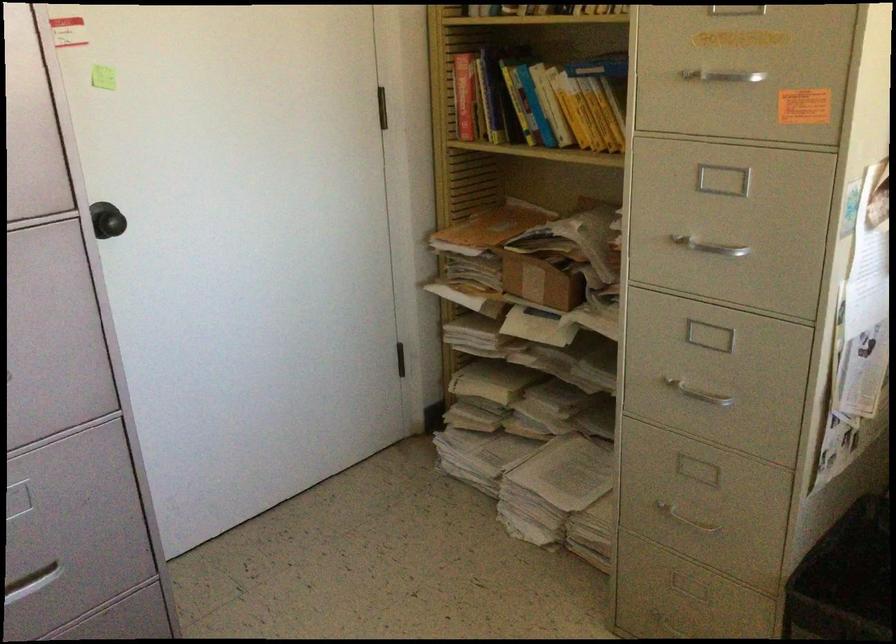
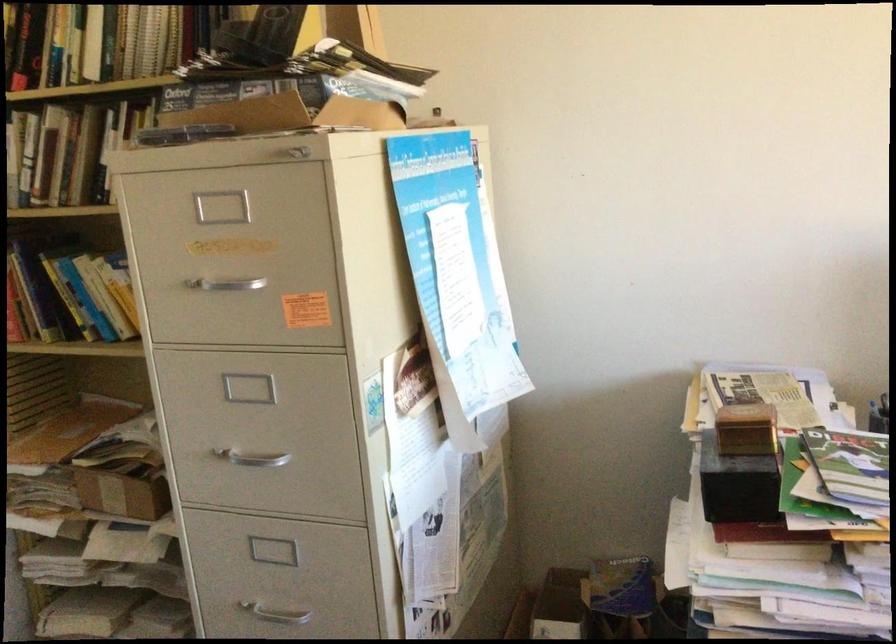
The point at (718,76) is marked in the first image. Where is the corresponding point in the second image?

(224, 283)